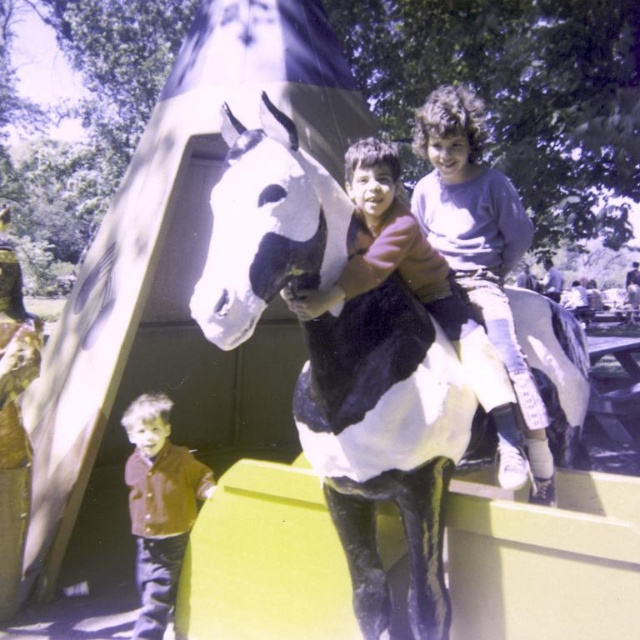
Which of these two, matte black horse at center or brown velvet jacket at lower left, stands taller?

With more height is matte black horse at center.

Who is higher up, matte black horse at center or brown velvet jacket at lower left?

Positioned higher is matte black horse at center.

Does point (426, 282) come in front of point (154, 634)?

That is True.

Locate an element on the screen. The width and height of the screenshot is (640, 640). matte black horse at center is located at coordinates (417, 289).

Consider the image. Is the position of purple cotton shirt at upper right more distant than that of brown velvet jacket at lower left?

No, purple cotton shirt at upper right is in front of brown velvet jacket at lower left.

Is purple cotton shirt at upper right below brown velvet jacket at lower left?

Actually, purple cotton shirt at upper right is above brown velvet jacket at lower left.

Does point (422, 104) lie in front of point (138, 419)?

No, (422, 104) is further to viewer.

This screenshot has height=640, width=640. Find the location of `purple cotton shirt at upper right`. purple cotton shirt at upper right is located at coordinates pos(477,243).

Where is `white matte horse at center`? The width and height of the screenshot is (640, 640). white matte horse at center is located at coordinates (387, 438).

Who is shorter, white matte horse at center or matte black horse at center?

matte black horse at center

Is point (205, 333) positioned after point (410, 248)?

No, it is in front of (410, 248).

This screenshot has width=640, height=640. What are the coordinates of `white matte horse at center` in the screenshot? It's located at (387, 438).